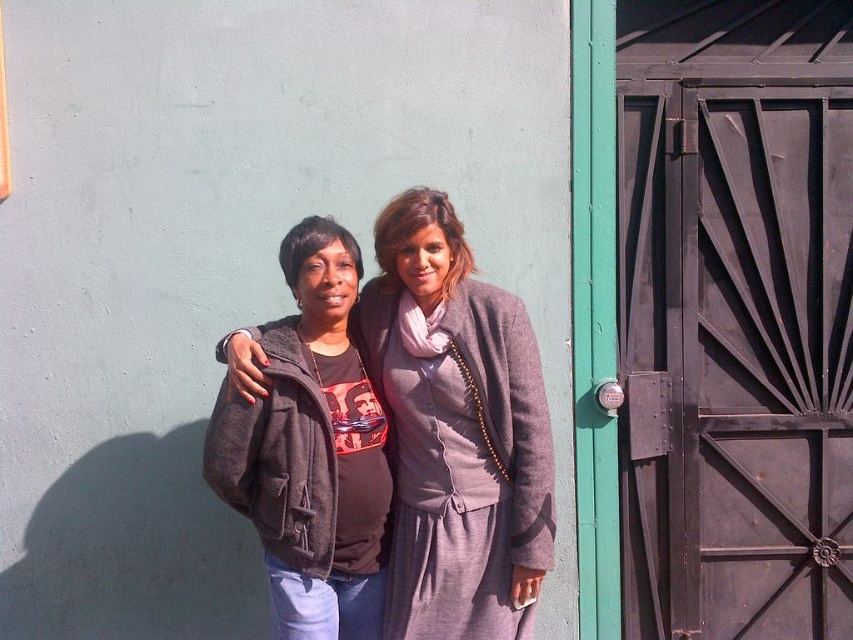
Question: Is matte gray sweater at center above matte brown jacket at center?

Choices:
 (A) yes
 (B) no

Answer: (A)

Question: Is black metal door at right below matte brown jacket at center?

Choices:
 (A) yes
 (B) no

Answer: (B)

Question: Does matte gray sweater at center have a smaller size compared to matte brown jacket at center?

Choices:
 (A) no
 (B) yes

Answer: (A)

Question: Which point is farther from the camera taking this photo?

Choices:
 (A) (407, 516)
 (B) (814, 484)
 (C) (367, 381)

Answer: (B)

Question: Estimate the real-world distances between objects in this image. Which object is farther from the matte gray sweater at center?

Choices:
 (A) matte brown jacket at center
 (B) black metal door at right

Answer: (B)

Question: Which point appears closest to the camera in this image?

Choices:
 (A) (412, 198)
 (B) (347, 413)
 (C) (706, 352)

Answer: (B)